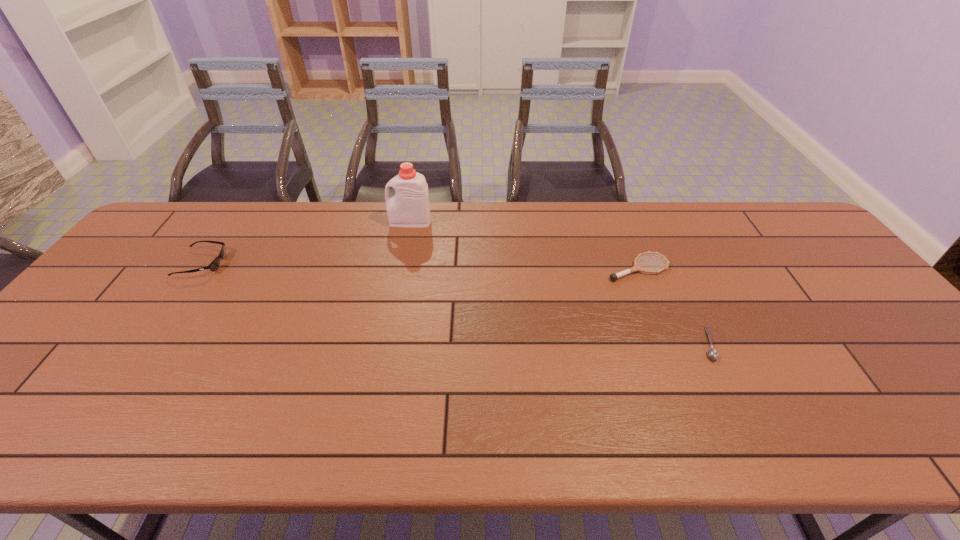
Where is `free spot between the soupspoon and the third shortest object`? This screenshot has height=540, width=960. free spot between the soupspoon and the third shortest object is located at coordinates (455, 303).

Image resolution: width=960 pixels, height=540 pixels. What are the coordinates of `free space between the farthest object and the second shortest object` in the screenshot? It's located at (524, 245).

This screenshot has height=540, width=960. Find the location of `empty location between the tennis racket and the leftmost object`. empty location between the tennis racket and the leftmost object is located at coordinates coord(420,266).

The image size is (960, 540). What are the coordinates of `empty location between the sunglasses and the soupspoon` in the screenshot? It's located at (455, 303).

In order to click on vacant area that lies between the detergent and the third tallest object in this screenshot , I will do `click(524, 245)`.

Identify the location of vacant point located between the tennis racket and the sunglasses. (420, 266).

The width and height of the screenshot is (960, 540). I want to click on free space between the nearest object and the second object from left to right, so click(x=560, y=283).

What are the coordinates of `object that is the third closest to the nearest object` in the screenshot? It's located at (213, 266).

Identify which object is located as the second nearest to the second object from left to right. Please provide its 2D coordinates. Your answer should be formatted as a tuple, i.e. [(x, y)], where the tuple contains the x and y coordinates of a point satisfying the conditions above.

[(636, 267)]

You are a GUI agent. You are given a task and a screenshot of the screen. Output one action in this format:
    pyautogui.click(x=<x>, y=<y>)
    Task: Click on the free spot that satisfies the following two spatial constraints: 1. on the front-facing side of the leftmost object; 2. on the left side of the shortest object
    This screenshot has height=540, width=960.
    Given the screenshot: What is the action you would take?
    pyautogui.click(x=146, y=344)